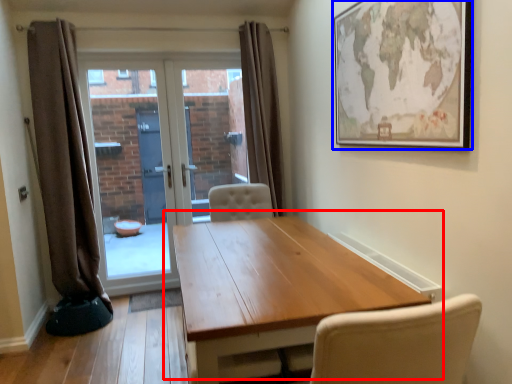
Question: Which object is further to the camera taking this photo, table (highlighted by a red box) or picture frame (highlighted by a blue box)?

Choices:
 (A) table
 (B) picture frame

Answer: (B)